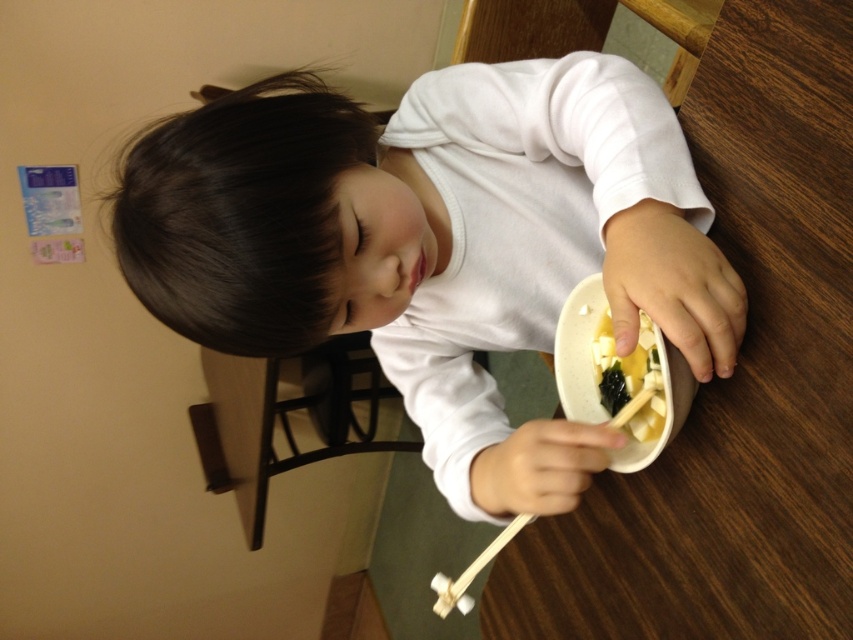
Question: Where is white matte shirt at center located in relation to yellow matte tofu at center in the image?

Choices:
 (A) right
 (B) left

Answer: (B)

Question: Among these objects, which one is nearest to the camera?

Choices:
 (A) yellow matte tofu at center
 (B) white matte shirt at center

Answer: (B)

Question: Can you confirm if white matte shirt at center is bigger than yellow matte tofu at center?

Choices:
 (A) yes
 (B) no

Answer: (A)

Question: Is white matte shirt at center to the right of yellow matte tofu at center from the viewer's perspective?

Choices:
 (A) no
 (B) yes

Answer: (A)